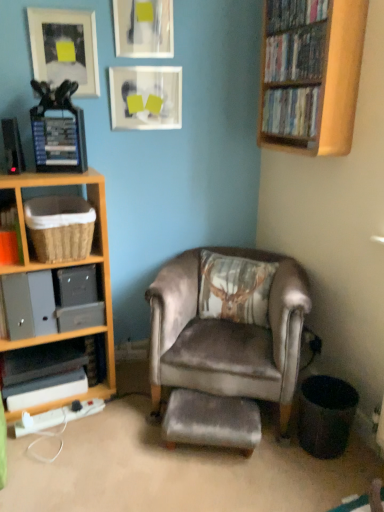
Question: Is woven brown basket at left, which ranks as the 3th shelf in bottom-to-top order, thinner than matte plastic dvds at upper right, which ranks as the third book in top-to-bottom order?

Choices:
 (A) yes
 (B) no

Answer: (B)

Question: Does woven brown basket at left, which ranks as the 3th shelf in bottom-to-top order, have a greater height compared to matte plastic dvds at upper right, the 1th book positioned from the bottom?

Choices:
 (A) yes
 (B) no

Answer: (A)

Question: Is the depth of woven brown basket at left, which ranks as the 3th shelf in bottom-to-top order, greater than that of matte plastic dvds at upper right, the 1th book positioned from the bottom?

Choices:
 (A) no
 (B) yes

Answer: (A)

Question: Is woven brown basket at left, which ranks as the 3th shelf in bottom-to-top order, positioned with its back to matte plastic dvds at upper right, which ranks as the third book in top-to-bottom order?

Choices:
 (A) yes
 (B) no

Answer: (B)

Question: Is woven brown basket at left, the first shelf in the top-to-bottom sequence, completely or partially outside of matte plastic dvds at upper right, the 1th book positioned from the bottom?

Choices:
 (A) yes
 (B) no

Answer: (A)

Question: Looking at the image, does velvet brown armchair at center seem bigger or smaller compared to matte black books at left, marked as the first shelf in a bottom-to-top arrangement?

Choices:
 (A) small
 (B) big

Answer: (B)

Question: Is point (158, 287) closer or farther from the camera than point (64, 339)?

Choices:
 (A) closer
 (B) farther

Answer: (A)

Question: From a real-world perspective, is velvet brown armchair at center above or below matte black books at left, marked as the first shelf in a bottom-to-top arrangement?

Choices:
 (A) below
 (B) above

Answer: (B)

Question: Is velvet brown armchair at center taller or shorter than matte black books at left, marked as the first shelf in a bottom-to-top arrangement?

Choices:
 (A) short
 (B) tall

Answer: (B)

Question: Considering the positions of matte black books at left, marked as the first shelf in a bottom-to-top arrangement, and woven brown basket at left, which ranks as the 3th shelf in bottom-to-top order, in the image, is matte black books at left, marked as the first shelf in a bottom-to-top arrangement, wider or thinner than woven brown basket at left, which ranks as the 3th shelf in bottom-to-top order,?

Choices:
 (A) wide
 (B) thin

Answer: (B)

Question: Considering the positions of point (69, 333) and point (39, 229), is point (69, 333) closer or farther from the camera than point (39, 229)?

Choices:
 (A) closer
 (B) farther

Answer: (B)

Question: Is matte black books at left, the 3th shelf in the top-to-bottom sequence, bigger or smaller than woven brown basket at left, the first shelf in the top-to-bottom sequence?

Choices:
 (A) small
 (B) big

Answer: (A)

Question: From the image's perspective, relative to woven brown basket at left, the first shelf in the top-to-bottom sequence, is matte black books at left, the 3th shelf in the top-to-bottom sequence, above or below?

Choices:
 (A) above
 (B) below

Answer: (B)

Question: From the image's perspective, relative to woven brown basket at left, the first shelf in the top-to-bottom sequence, is wooden bookshelf at upper right above or below?

Choices:
 (A) above
 (B) below

Answer: (A)

Question: Does point (342, 38) appear closer or farther from the camera than point (46, 239)?

Choices:
 (A) closer
 (B) farther

Answer: (A)